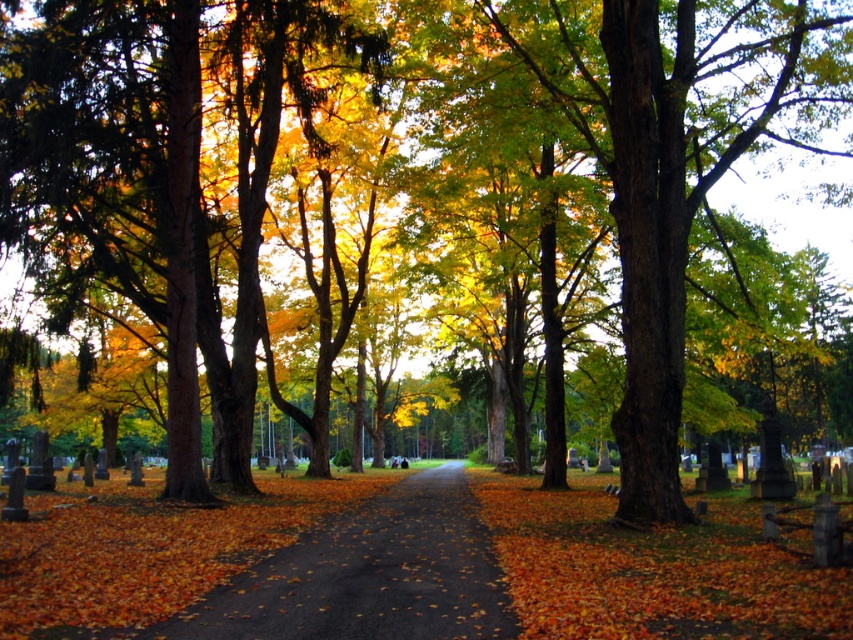
Find the location of a particular element. The image size is (853, 640). golden yellow leaves at left is located at coordinates (158, 177).

Between golden yellow leaves at left and brown asphalt path at center, which one appears on the left side from the viewer's perspective?

Positioned to the left is golden yellow leaves at left.

What do you see at coordinates (158, 177) in the screenshot? Image resolution: width=853 pixels, height=640 pixels. I see `golden yellow leaves at left` at bounding box center [158, 177].

This screenshot has width=853, height=640. Identify the location of golden yellow leaves at left. (158, 177).